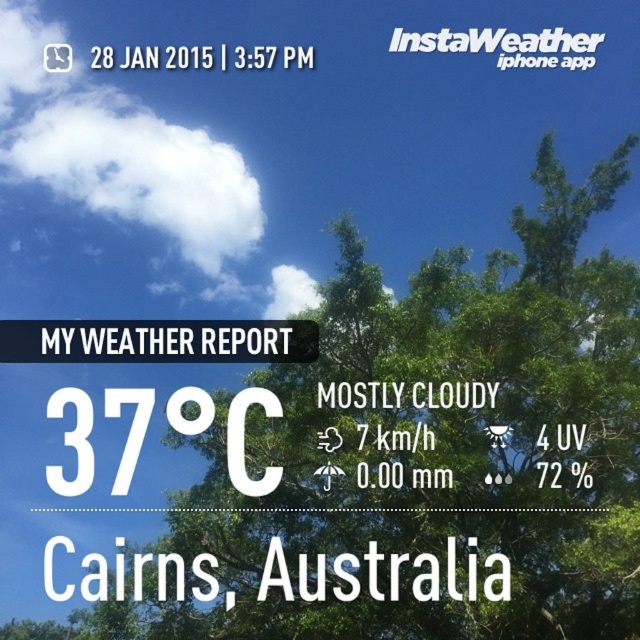
Question: Which point appears farthest from the camera in this image?

Choices:
 (A) (177, 138)
 (B) (532, 312)

Answer: (A)

Question: Can you confirm if green leafy tree at upper center is positioned above white fluffy cloud at upper left?

Choices:
 (A) no
 (B) yes

Answer: (A)

Question: Does green leafy tree at upper center come behind white fluffy cloud at upper left?

Choices:
 (A) yes
 (B) no

Answer: (B)

Question: Which point is farther from the camera taking this photo?

Choices:
 (A) [x=480, y=356]
 (B) [x=220, y=264]

Answer: (B)

Question: Which object is closer to the camera taking this photo?

Choices:
 (A) green leafy tree at upper center
 (B) white fluffy cloud at upper left

Answer: (A)

Question: Does green leafy tree at upper center come behind white fluffy cloud at upper left?

Choices:
 (A) yes
 (B) no

Answer: (B)